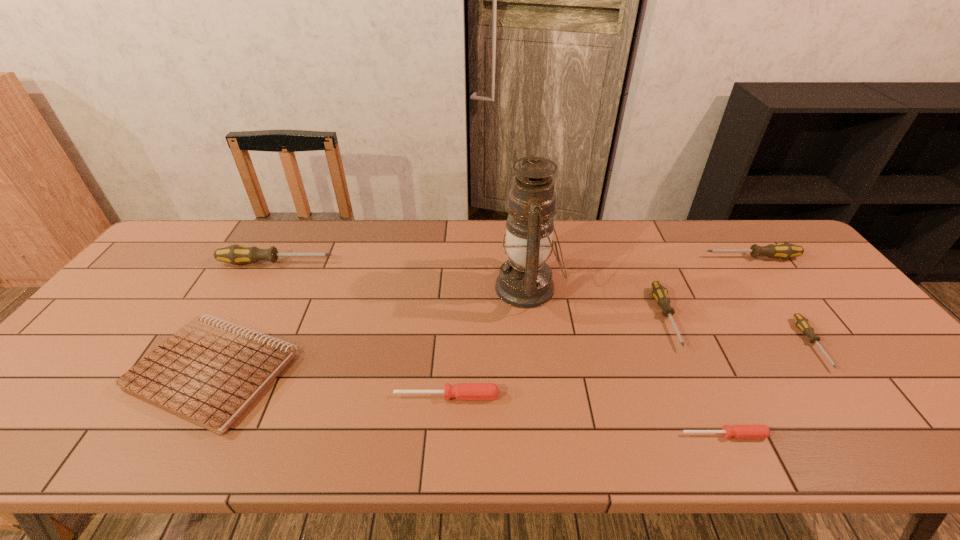
Where is `free space that is in between the nearest screwdriver and the smallest gray screwdriver`? Image resolution: width=960 pixels, height=540 pixels. free space that is in between the nearest screwdriver and the smallest gray screwdriver is located at coordinates (768, 389).

This screenshot has height=540, width=960. What are the coordinates of `the closest object to the leftmost screwdriver` in the screenshot? It's located at (209, 373).

Identify the location of object that is the second closest one to the fourth shortest screwdriver. The height and width of the screenshot is (540, 960). (784, 250).

Locate which screwdriver ranks in proximity to the biggest gray screwdriver. Please provide its 2D coordinates. Your answer should be formatted as a tuple, i.e. [(x, y)], where the tuple contains the x and y coordinates of a point satisfying the conditions above.

[(463, 391)]

Find the location of a particular element. screwdriver object that ranks as the second closest to the smallest gray screwdriver is located at coordinates (739, 431).

Locate an element on the screen. The height and width of the screenshot is (540, 960). the second closest gray screwdriver relative to the fifth shortest screwdriver is located at coordinates (801, 322).

The width and height of the screenshot is (960, 540). Find the location of `the third closest gray screwdriver to the fifth screwdriver from right to left`. the third closest gray screwdriver to the fifth screwdriver from right to left is located at coordinates (801, 322).

Identify the location of free spot that satisfies the following two spatial constraints: 1. at the tip of the seventh shortest object; 2. on the right side of the fourth object from left to right. This screenshot has height=540, width=960. (263, 288).

Find the location of `free space in the image that satisfies the following two spatial constraints: 1. on the back side of the tallest object; 2. at the tip of the leftmost screwdriver`. free space in the image that satisfies the following two spatial constraints: 1. on the back side of the tallest object; 2. at the tip of the leftmost screwdriver is located at coordinates (525, 263).